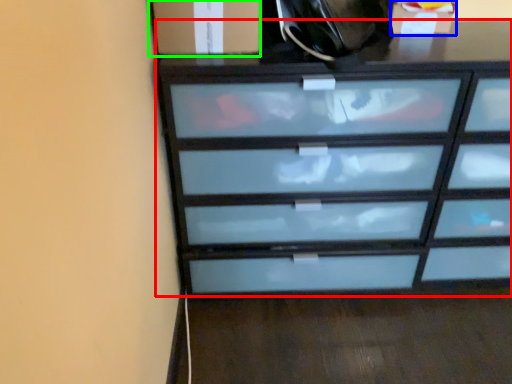
Question: Which object is the farthest from chest of drawers (highlighted by a red box)? Choose among these: cabinetry (highlighted by a blue box) or cabinetry (highlighted by a green box).

Choices:
 (A) cabinetry
 (B) cabinetry

Answer: (A)